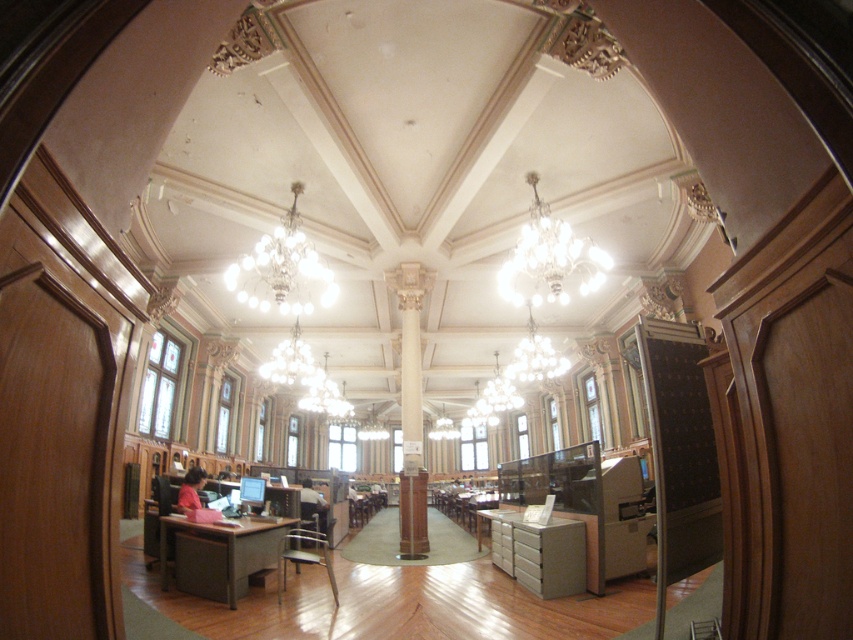
You are an interior designer planning to install a new lighting fixture in this library. You have two options from the image, the white glass chandelier at center and the matte gold chandelier at center. Which one is shorter and would require less ceiling clearance?

The white glass chandelier at center is shorter than the matte gold chandelier at center, so it would require less ceiling clearance.

You are an interior designer planning to install a new lighting fixture in the center of the library. You have two options available from the image, the clear glass chandelier at center and the white glass chandelier at center. Which one has a larger width and would require more horizontal space?

The clear glass chandelier at center has a larger width than the white glass chandelier at center, so it would require more horizontal space.